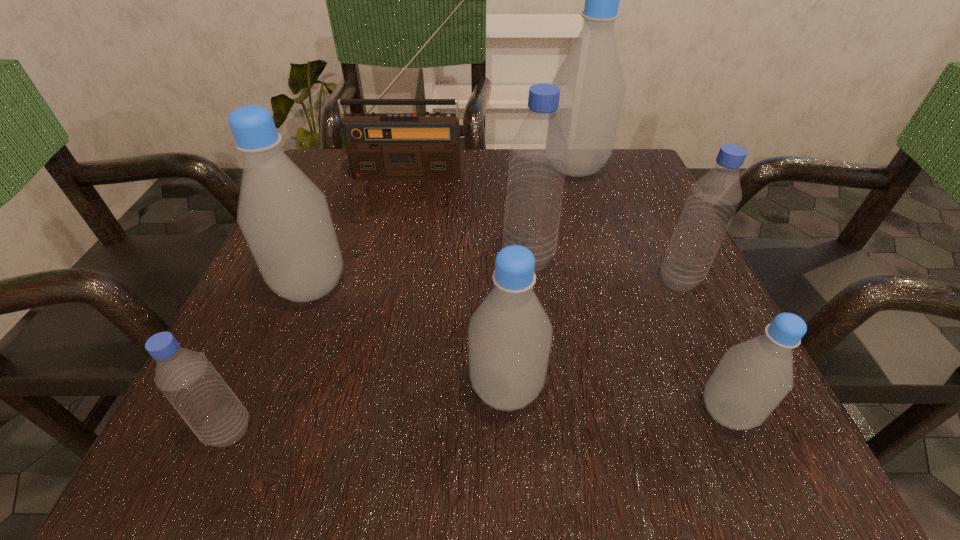
Where is `the biggest gray bottle`? the biggest gray bottle is located at coordinates (592, 87).

This screenshot has height=540, width=960. I want to click on the farthest gray bottle, so click(592, 87).

Image resolution: width=960 pixels, height=540 pixels. I want to click on radio receiver, so click(425, 146).

You are a GUI agent. You are given a task and a screenshot of the screen. Output one action in this format:
    pyautogui.click(x=<x>, y=<y>)
    Task: Click on the biggest blue bottle
    
    Given the screenshot: What is the action you would take?
    pyautogui.click(x=538, y=156)

The height and width of the screenshot is (540, 960). What are the coordinates of `the second biggest gray bottle` in the screenshot? It's located at (285, 219).

Find the location of a particular element. This screenshot has height=540, width=960. the third nearest gray bottle is located at coordinates (285, 219).

The width and height of the screenshot is (960, 540). I want to click on the rightmost blue bottle, so click(x=713, y=200).

What are the coordinates of `the third biggest gray bottle` in the screenshot? It's located at (509, 336).

At what (x,y) coordinates should I click in order to perform the action: click on the smallest gray bottle. Please return your answer as a coordinate pair (x, y). Looking at the image, I should click on point(752,378).

In order to click on the nearest blue bottle in this screenshot , I will do `click(188, 380)`.